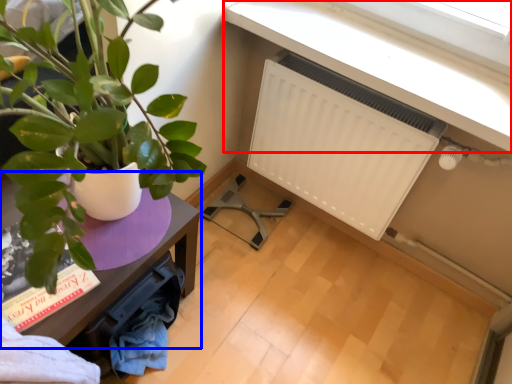
Question: Which object appears farthest to the camera in this image, window sill (highlighted by a red box) or table (highlighted by a blue box)?

Choices:
 (A) window sill
 (B) table

Answer: (A)